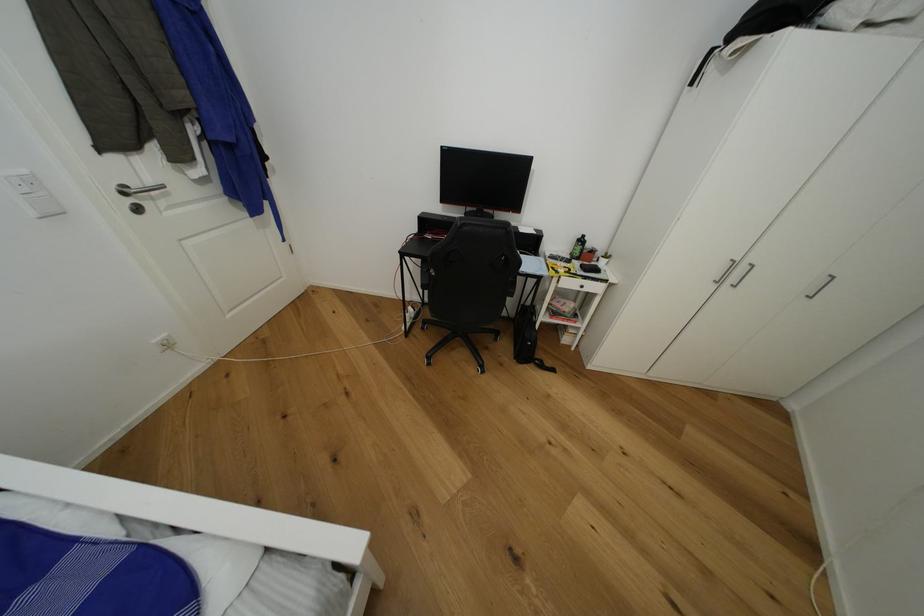
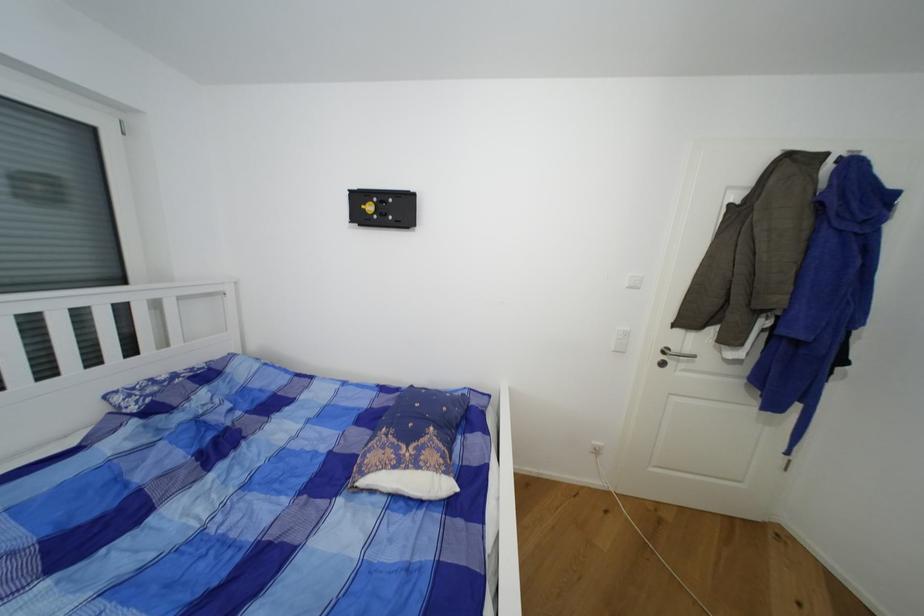
Question: Based on the continuous images, in which direction is the camera rotating? Reply with the corresponding letter.

Choices:
 (A) Left
 (B) Right
 (C) Up
 (D) Down

Answer: (A)